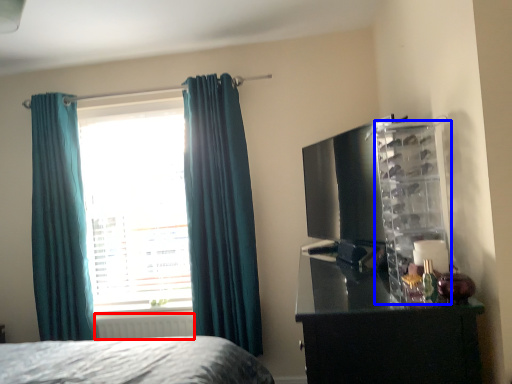
Question: Which of the following is the farthest to the observer, radiator (highlighted by a red box) or cabinet (highlighted by a blue box)?

Choices:
 (A) radiator
 (B) cabinet

Answer: (A)